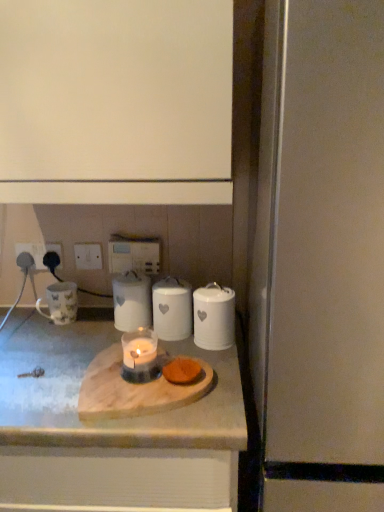
Find the location of `blank space situated above white marble countertop at center (from a real-world perspective)`. blank space situated above white marble countertop at center (from a real-world perspective) is located at coordinates (95, 354).